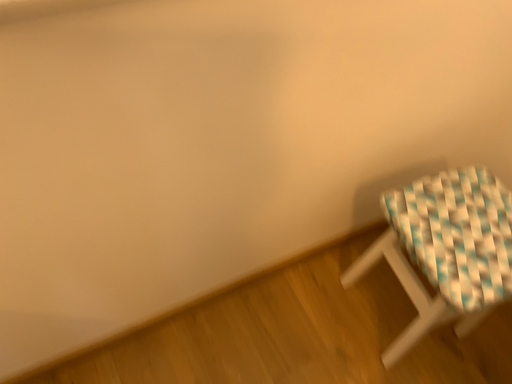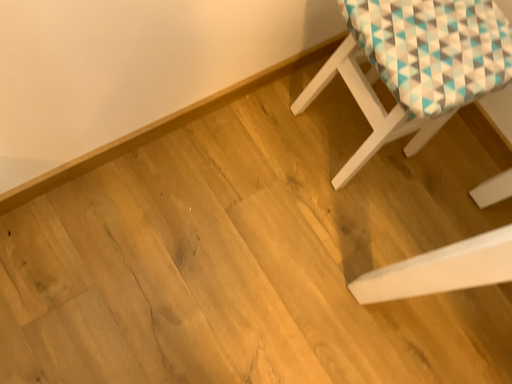
Question: Which way did the camera rotate in the video?

Choices:
 (A) rotated downward
 (B) rotated upward

Answer: (A)